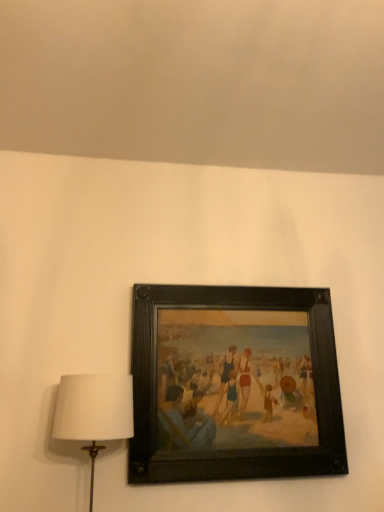
Question: Is white fabric lampshade at left to the left of wooden picture frame at center from the viewer's perspective?

Choices:
 (A) yes
 (B) no

Answer: (A)

Question: From the image's perspective, is white fabric lampshade at left over wooden picture frame at center?

Choices:
 (A) yes
 (B) no

Answer: (B)

Question: From a real-world perspective, does white fabric lampshade at left stand above wooden picture frame at center?

Choices:
 (A) no
 (B) yes

Answer: (A)

Question: Is white fabric lampshade at left further to the viewer compared to wooden picture frame at center?

Choices:
 (A) no
 (B) yes

Answer: (A)

Question: Is white fabric lampshade at left facing away from wooden picture frame at center?

Choices:
 (A) yes
 (B) no

Answer: (B)

Question: From a real-world perspective, is white fabric lampshade at left under wooden picture frame at center?

Choices:
 (A) yes
 (B) no

Answer: (A)

Question: Does wooden picture frame at center have a smaller size compared to white fabric lampshade at left?

Choices:
 (A) yes
 (B) no

Answer: (B)

Question: Is wooden picture frame at center aimed at white fabric lampshade at left?

Choices:
 (A) no
 (B) yes

Answer: (A)

Question: Considering the relative sizes of wooden picture frame at center and white fabric lampshade at left in the image provided, is wooden picture frame at center taller than white fabric lampshade at left?

Choices:
 (A) yes
 (B) no

Answer: (A)

Question: Considering the relative positions of wooden picture frame at center and white fabric lampshade at left in the image provided, is wooden picture frame at center behind white fabric lampshade at left?

Choices:
 (A) no
 (B) yes

Answer: (B)

Question: Is wooden picture frame at center thinner than white fabric lampshade at left?

Choices:
 (A) no
 (B) yes

Answer: (B)

Question: From the image's perspective, is wooden picture frame at center under white fabric lampshade at left?

Choices:
 (A) yes
 (B) no

Answer: (B)

Question: From a real-world perspective, is white fabric lampshade at left above or below wooden picture frame at center?

Choices:
 (A) below
 (B) above

Answer: (A)